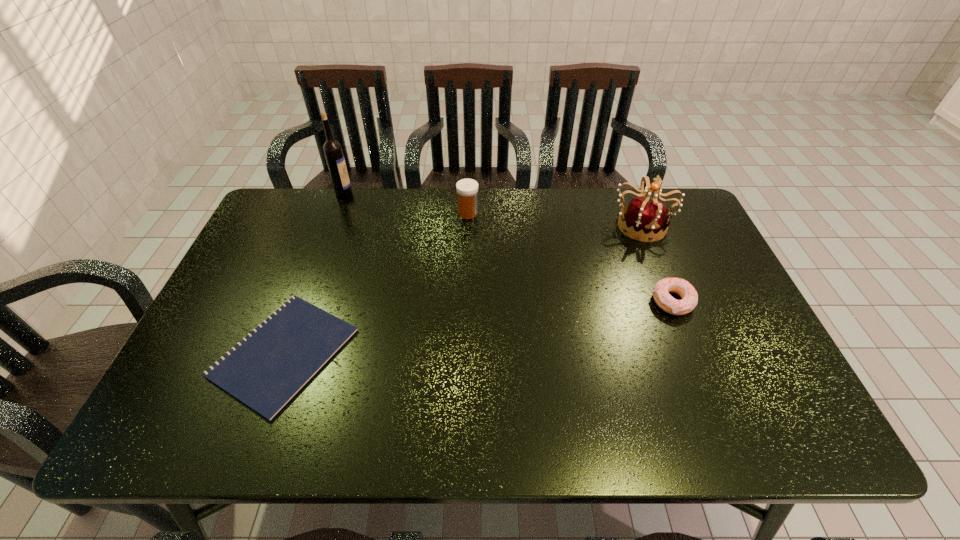
Locate an element on the screen. The width and height of the screenshot is (960, 540). object that is at the far right corner is located at coordinates (642, 216).

At what (x,y) coordinates should I click in order to perform the action: click on vacant area at the far edge of the desktop. Please return your answer as a coordinate pair (x, y). Looking at the image, I should click on (589, 203).

Where is `free space at the near edge of the desktop`? Image resolution: width=960 pixels, height=540 pixels. free space at the near edge of the desktop is located at coordinates (442, 435).

In the image, there is a desktop. At what (x,y) coordinates should I click in order to perform the action: click on vacant space at the left edge. Please return your answer as a coordinate pair (x, y). Looking at the image, I should click on (302, 240).

What are the coordinates of `vacant space at the right edge of the desktop` in the screenshot? It's located at (741, 321).

Find the location of a particular element. The height and width of the screenshot is (540, 960). vacant space at the far left corner of the desktop is located at coordinates (307, 199).

Find the location of a particular element. The image size is (960, 540). vacant space at the near left corner is located at coordinates (211, 411).

In the image, there is a desktop. Where is `vacant space at the far right corner`? The height and width of the screenshot is (540, 960). vacant space at the far right corner is located at coordinates (666, 192).

Locate an element on the screen. vacant area that lies between the wine bottle and the second tallest object is located at coordinates (492, 208).

At what (x,y) coordinates should I click in order to perform the action: click on empty space that is in between the second tallest object and the shortest object. Please return your answer as a coordinate pair (x, y). The image size is (960, 540). Looking at the image, I should click on (463, 288).